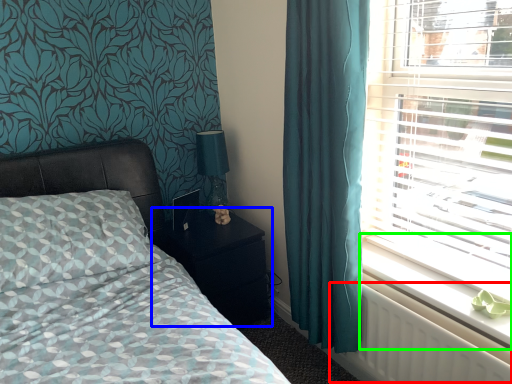
Question: Based on their relative distances, which object is nearer to radiator (highlighted by a red box)? Choose from nightstand (highlighted by a blue box) and window sill (highlighted by a green box).

Choices:
 (A) nightstand
 (B) window sill

Answer: (B)